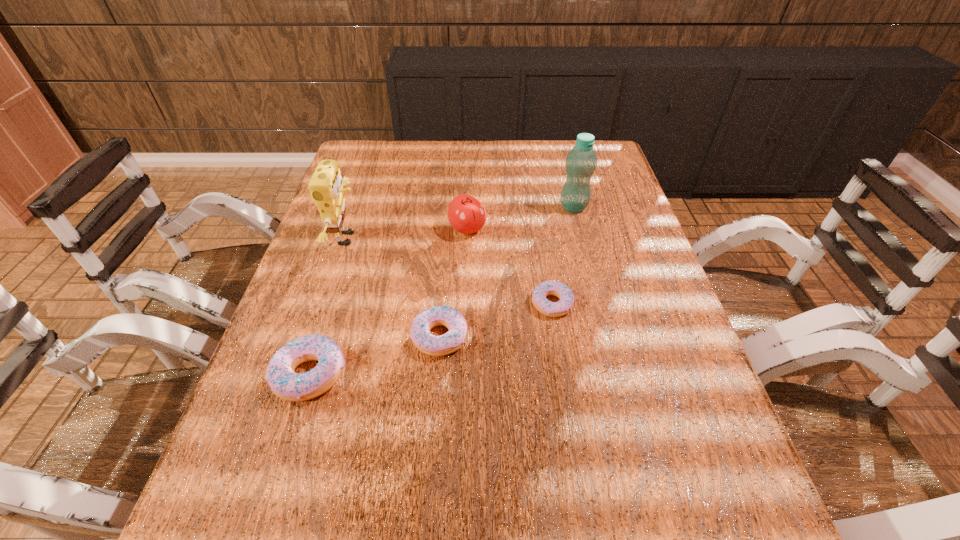
Where is `the tallest doughnut`? This screenshot has height=540, width=960. the tallest doughnut is located at coordinates (280, 374).

This screenshot has height=540, width=960. Find the location of `the leftmost doughnut`. the leftmost doughnut is located at coordinates (280, 374).

I want to click on the second tallest doughnut, so click(x=432, y=345).

At what (x,y) coordinates should I click in order to perform the action: click on the fifth tallest object. Please return your answer as a coordinate pair (x, y). The width and height of the screenshot is (960, 540). Looking at the image, I should click on (432, 345).

Find the location of `the rightmost doughnut`. the rightmost doughnut is located at coordinates (551, 287).

The image size is (960, 540). I want to click on the shortest doughnut, so click(x=551, y=287).

You are a GUI agent. You are given a task and a screenshot of the screen. Output one action in this format:
    pyautogui.click(x=<x>, y=<y>)
    Task: Click on the sponge
    The image size is (960, 540).
    Given the screenshot: What is the action you would take?
    pyautogui.click(x=326, y=186)

The image size is (960, 540). In order to click on water bottle in this screenshot , I will do `click(581, 161)`.

Find the location of `the fourth shortest object`. the fourth shortest object is located at coordinates (466, 214).

At what (x,y) coordinates should I click in order to perform the action: click on vacant area located on the back of the third shortest object. Please return your answer as a coordinate pair (x, y). Looking at the image, I should click on (327, 321).